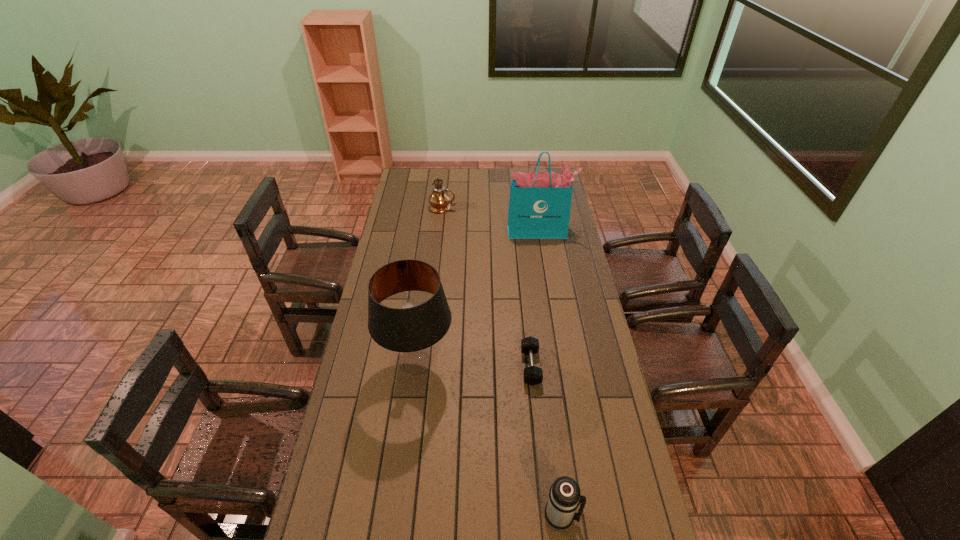
You are a GUI agent. You are given a task and a screenshot of the screen. Output one action in this format:
    pyautogui.click(x=<x>, y=<y>)
    Task: Click on the free space between the thermos bottle and the shortest object
    The image size is (960, 540).
    Given the screenshot: What is the action you would take?
    coord(546,442)

Where is `free spot between the oil lamp and the shortest object`? free spot between the oil lamp and the shortest object is located at coordinates (487, 287).

The height and width of the screenshot is (540, 960). I want to click on unoccupied area between the lampshade and the nearest object, so 489,440.

Where is `vacant region between the second farthest object and the lampshade`? This screenshot has height=540, width=960. vacant region between the second farthest object and the lampshade is located at coordinates (478, 297).

Identify the location of free spot between the farthest object and the second farthest object. point(491,219).

Find the location of a particular element. vacant region between the shortest object and the lampshade is located at coordinates (474, 365).

Find the location of `object identified as the closest to the farthest object`. object identified as the closest to the farthest object is located at coordinates (540, 202).

The width and height of the screenshot is (960, 540). I want to click on object that ranks as the third closest to the nearest object, so click(x=540, y=202).

Locate an element on the screen. Image resolution: width=960 pixels, height=540 pixels. free space that satisfies the following two spatial constraints: 1. on the front side of the shopping bag; 2. on the left side of the farthest object is located at coordinates (441, 231).